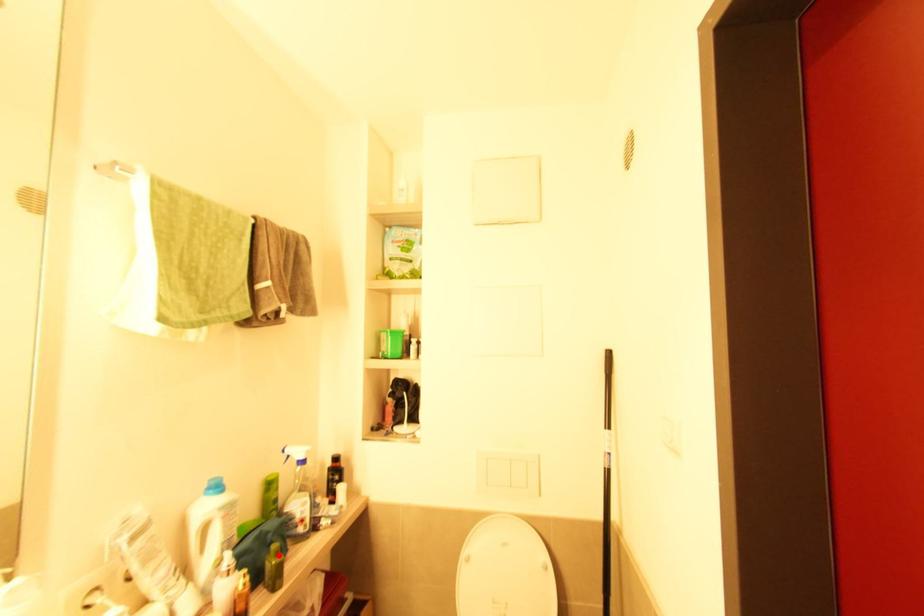
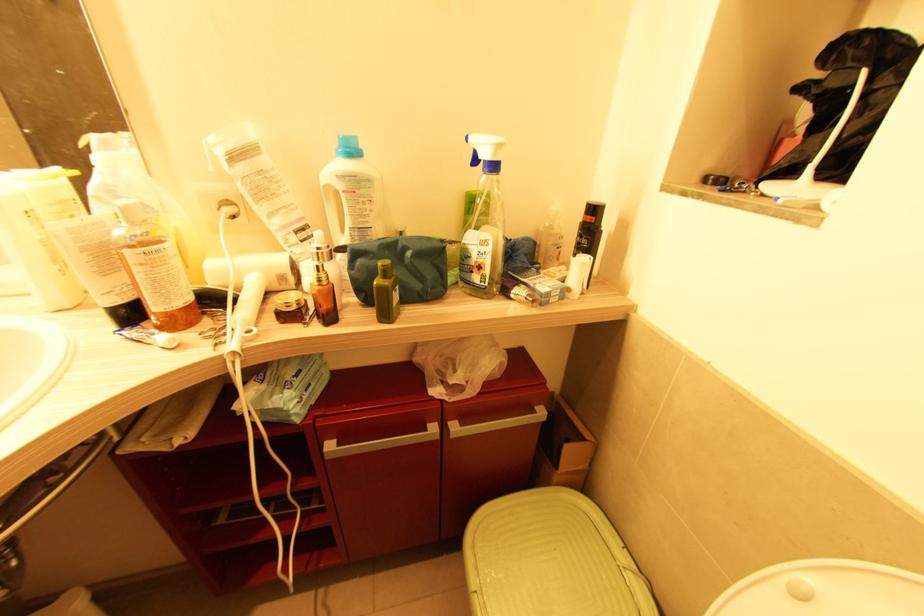
Question: I am providing you with two images of the same scene from different viewpoints. A red point is marked on the first image. At the location where the point appears in image 1, is it still visible in image 2?

Choices:
 (A) Yes
 (B) No

Answer: (A)